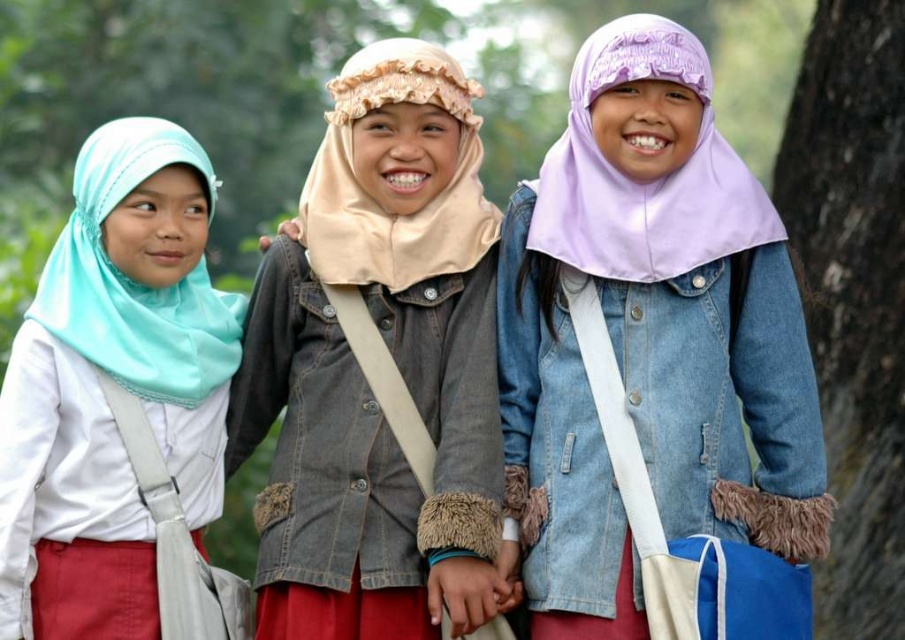
Who is more forward, (584,568) or (35,330)?

Point (584,568) is more forward.

Who is more forward, (729, 499) or (118, 248)?

Point (729, 499)

Where is `purple matte hijab at center`? This screenshot has width=905, height=640. purple matte hijab at center is located at coordinates (649, 339).

Is point (110, 262) farther from camera compared to point (894, 536)?

No, it is in front of (894, 536).

Which of these two, matte light blue hijab at left or smooth bark tree at right, stands taller?

smooth bark tree at right is taller.

The width and height of the screenshot is (905, 640). In order to click on matte light blue hijab at left in this screenshot , I will do `click(121, 406)`.

Between purple matte hijab at center and denim jacket at center, which one has less height?

denim jacket at center

Can you confirm if purple matte hijab at center is taller than denim jacket at center?

Yes.

Identify the location of purple matte hijab at center. (649, 339).